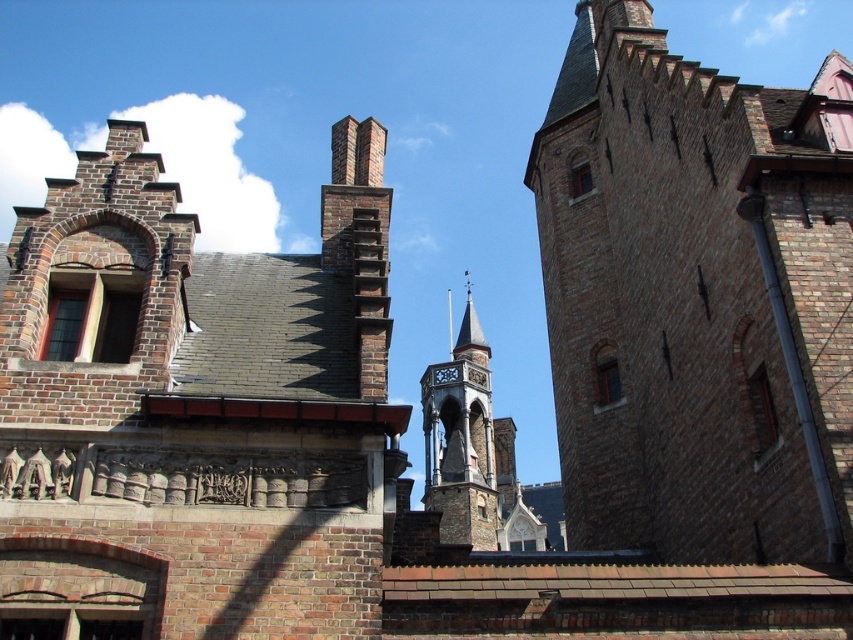
You are standing in front of the historic brick building and want to take a photo of both the brown brick tower at right and the stone steeple at center. To ensure both are in the frame, should you position yourself to the left or right of the building?

You should position yourself to the left of the building so that the brown brick tower at right is to your right and the stone steeple at center is centered in the frame. This way, both objects will be visible in the photo.

You are standing in front of the historic brick building and want to take a photo. You notice two points marked on the building. The first point is at coordinates point (722, 241) and the second is at point (428, 364). Which point is closer to your camera?

Point (722, 241) is closer to the camera than point (428, 364).

In the scene shown: You are a drone operator planning to fly a drone over the historic brick building. You need to ensure the drone can pass between the brick chimney at upper center and the smooth gray stone spire at center without hitting either. Based on the scene, can the drone safely navigate between them?

The brick chimney at upper center is not as tall as the smooth gray stone spire at center, so the drone can safely navigate between them as long as it stays above the chimney and below the spire.